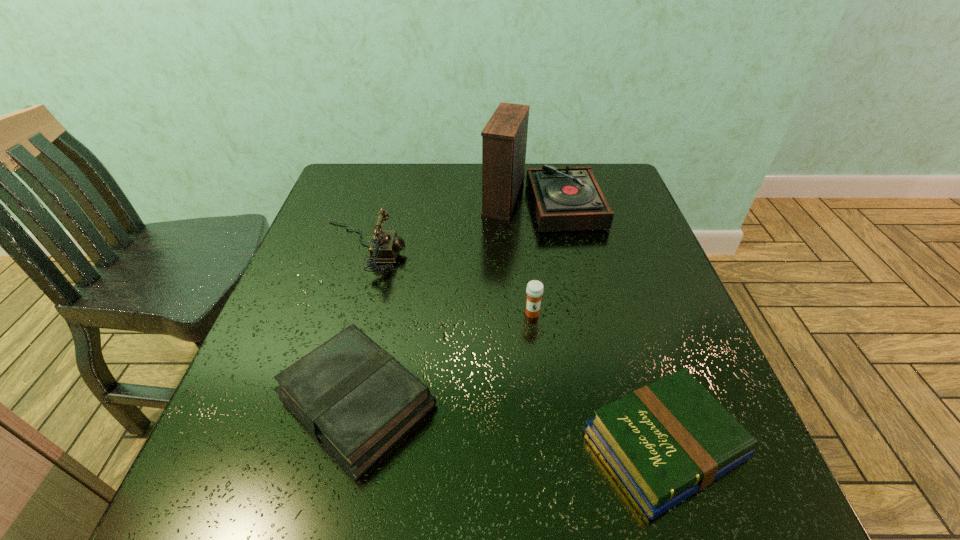
Where is `the tallest object`? The width and height of the screenshot is (960, 540). the tallest object is located at coordinates (567, 198).

I want to click on the second tallest object, so click(x=384, y=247).

The width and height of the screenshot is (960, 540). Find the location of `medicine`. medicine is located at coordinates (534, 290).

Locate an element on the screen. This screenshot has width=960, height=540. the third nearest object is located at coordinates (534, 290).

This screenshot has width=960, height=540. What are the coordinates of `the left book` in the screenshot? It's located at (356, 399).

I want to click on the right book, so click(x=666, y=441).

Where is `free space located on the front of the phonograph record`? free space located on the front of the phonograph record is located at coordinates (549, 251).

Locate an element on the screen. vacant space located 0.220m on the dial of the telephone is located at coordinates (496, 247).

Locate an element on the screen. Image resolution: width=960 pixels, height=540 pixels. free spot located on the label side of the third tallest object is located at coordinates (540, 386).

I want to click on free space located on the left of the left book, so click(x=231, y=401).